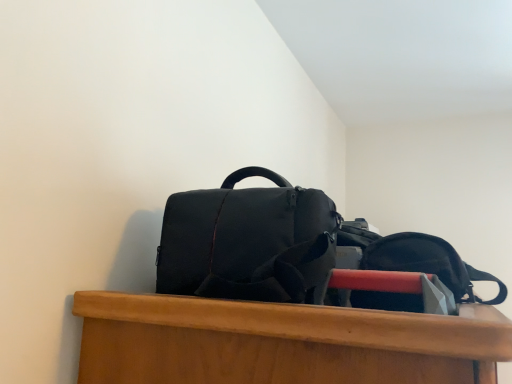
Question: Do you think matte black backpack at upper center, marked as the second backpack in a left-to-right arrangement, is within matte black duffel bag at upper center, the 1th backpack in the left-to-right sequence, or outside of it?

Choices:
 (A) inside
 (B) outside

Answer: (B)

Question: From a real-world perspective, is matte black backpack at upper center, the 1th backpack positioned from the right, above or below matte black duffel bag at upper center, the 1th backpack in the left-to-right sequence?

Choices:
 (A) above
 (B) below

Answer: (B)

Question: In terms of size, does matte black backpack at upper center, the 1th backpack positioned from the right, appear bigger or smaller than matte black duffel bag at upper center, marked as the 2th backpack in a right-to-left arrangement?

Choices:
 (A) small
 (B) big

Answer: (A)

Question: Is matte black duffel bag at upper center, the 1th backpack in the left-to-right sequence, bigger or smaller than matte black backpack at upper center, the 1th backpack positioned from the right?

Choices:
 (A) big
 (B) small

Answer: (A)

Question: Is matte black duffel bag at upper center, the 1th backpack in the left-to-right sequence, to the left or to the right of matte black backpack at upper center, the 1th backpack positioned from the right, in the image?

Choices:
 (A) left
 (B) right

Answer: (A)

Question: From a real-world perspective, is matte black duffel bag at upper center, the 1th backpack in the left-to-right sequence, above or below matte black backpack at upper center, marked as the second backpack in a left-to-right arrangement?

Choices:
 (A) below
 (B) above

Answer: (B)

Question: In terms of width, does matte black duffel bag at upper center, marked as the 2th backpack in a right-to-left arrangement, look wider or thinner when compared to matte black backpack at upper center, the 1th backpack positioned from the right?

Choices:
 (A) wide
 (B) thin

Answer: (A)